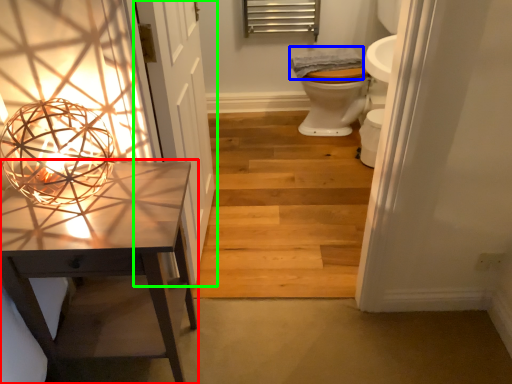
Question: Which object is positioned closest to table (highlighted by a red box)? Select from material (highlighted by a blue box) and door (highlighted by a green box).

Choices:
 (A) material
 (B) door

Answer: (B)